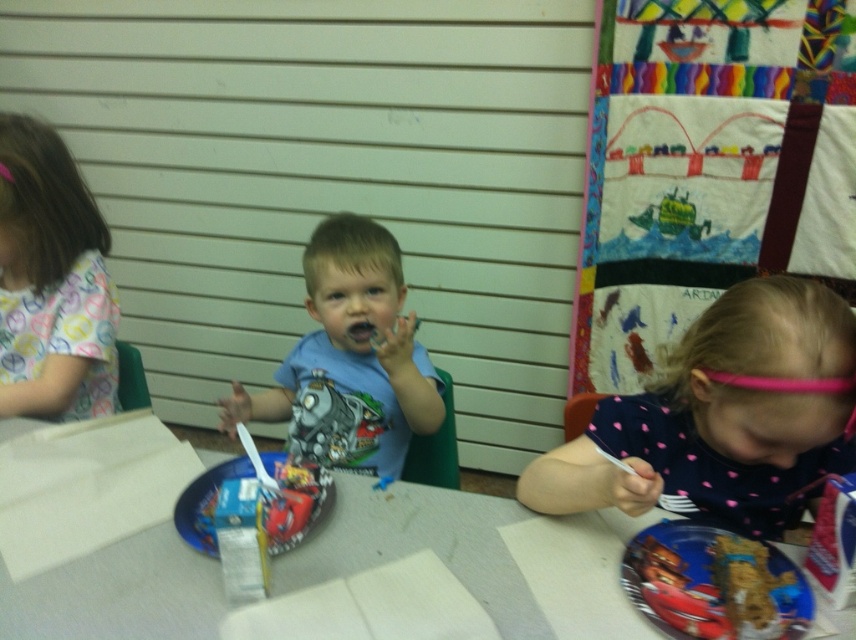
You are a parent trying to hand a napkin to your child. The child is wearing the pink dotted shirt at lower right and has a metallic blue plate at lower right. If the napkin is placed exactly halfway between them, how far will it be from the plate?

The napkin placed exactly halfway between the pink dotted shirt at lower right and the metallic blue plate at lower right will be 3.24 inches away from the plate.

You are a teacher observing the children at the table. You notice the white paper at center and the blue cotton shirt at center. Which object is located below the other?

The white paper at center is positioned under blue cotton shirt at center, so the white paper at center is below the blue cotton shirt at center.